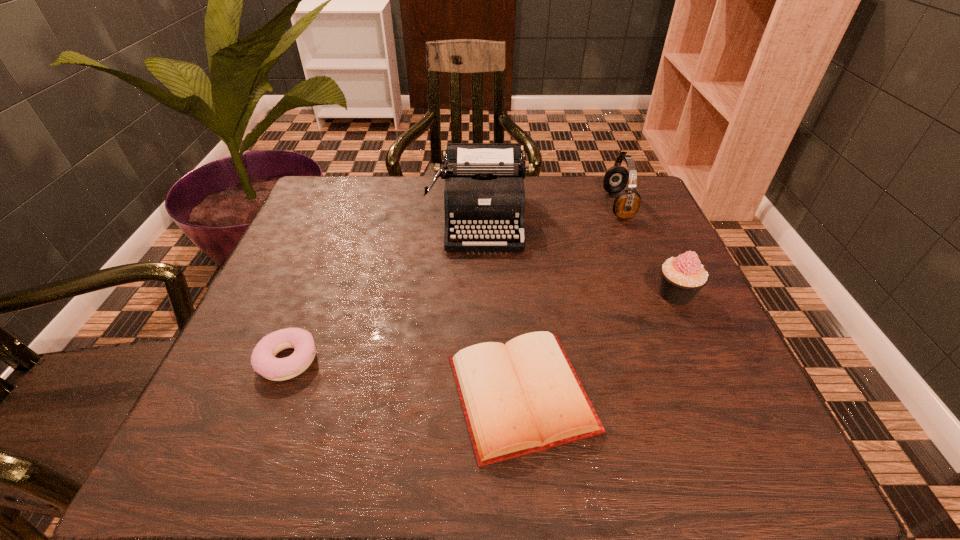
Find the location of a particular element. The height and width of the screenshot is (540, 960). free space located 0.210m on the ear cups of the headset is located at coordinates (527, 205).

The width and height of the screenshot is (960, 540). I want to click on vacant space situated 0.270m on the left of the third shortest object, so click(x=526, y=294).

This screenshot has height=540, width=960. In order to click on vacant space located on the back of the leftmost object in this screenshot , I will do `click(320, 280)`.

At what (x,y) coordinates should I click in order to perform the action: click on vacant space located 0.200m on the back of the Bible. Please return your answer as a coordinate pair (x, y). This screenshot has height=540, width=960. Looking at the image, I should click on point(512,267).

This screenshot has width=960, height=540. What are the coordinates of `typewriter located in the far edge section of the desktop` in the screenshot? It's located at (484, 193).

The height and width of the screenshot is (540, 960). I want to click on headset at the far edge, so click(x=627, y=203).

You are a GUI agent. You are given a task and a screenshot of the screen. Output one action in this format:
    pyautogui.click(x=<x>, y=<y>)
    Task: Click on the object located in the near edge section of the desktop
    
    Given the screenshot: What is the action you would take?
    pyautogui.click(x=522, y=397)

Find the location of a particular element. The height and width of the screenshot is (540, 960). object that is at the left edge is located at coordinates (263, 360).

Where is `headset that is at the right edge`? headset that is at the right edge is located at coordinates (627, 203).

This screenshot has height=540, width=960. I want to click on cupcake that is at the right edge, so click(682, 277).